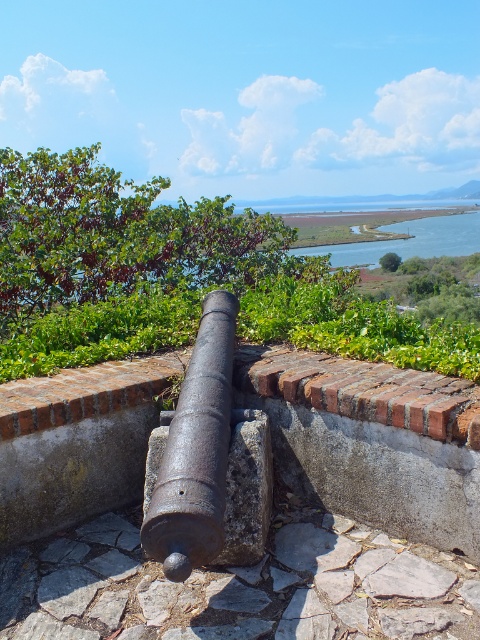
Question: Is rusty metal cannon at center below blue water at center?

Choices:
 (A) yes
 (B) no

Answer: (A)

Question: Is rusty metal cannon at center bigger than blue water at center?

Choices:
 (A) no
 (B) yes

Answer: (A)

Question: Which point is farther from the camera taking this photo?

Choices:
 (A) (460, 216)
 (B) (231, 362)

Answer: (A)

Question: Among these objects, which one is farthest from the camera?

Choices:
 (A) rusty metal cannon at center
 (B) blue water at center

Answer: (B)

Question: Is rusty metal cannon at center below blue water at center?

Choices:
 (A) no
 (B) yes

Answer: (B)

Question: Which object appears farthest from the camera in this image?

Choices:
 (A) rusty metal cannon at center
 (B) blue water at center

Answer: (B)